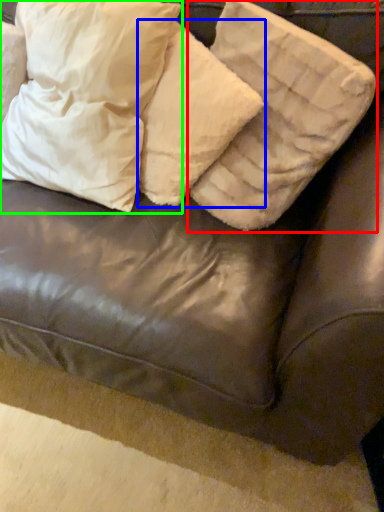
Question: Which object is the farthest from pillow (highlighted by a red box)? Choose among these: pillow (highlighted by a blue box) or pillow (highlighted by a green box).

Choices:
 (A) pillow
 (B) pillow

Answer: (B)